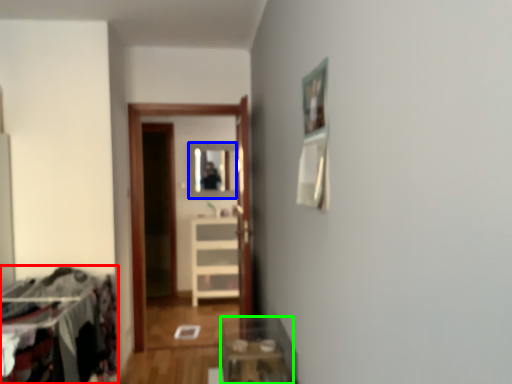
Question: Which object is positioned farthest from laundry (highlighted by a red box)? Select from mirror (highlighted by a blue box) and table (highlighted by a green box).

Choices:
 (A) mirror
 (B) table

Answer: (A)